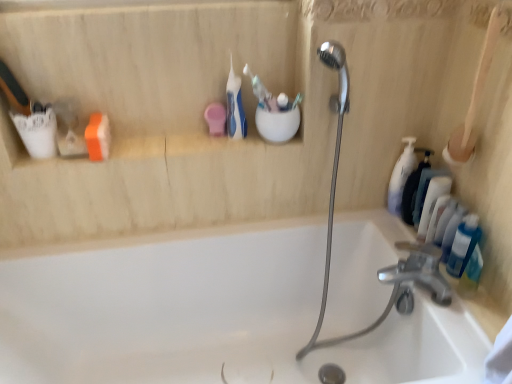
Question: Considering the positions of point (138, 332) and point (474, 276), is point (138, 332) closer or farther from the camera than point (474, 276)?

Choices:
 (A) farther
 (B) closer

Answer: (A)

Question: Visually, is white glossy bathtub at center positioned to the left or to the right of blue translucent bottle at right, the fourth toiletry when ordered from left to right?

Choices:
 (A) right
 (B) left

Answer: (B)

Question: Which of these objects is positioned closest to the translucent plastic bottles at right, arranged as the first toiletry when viewed from the right?

Choices:
 (A) blue plastic toothbrush at center, the 3th toothbrush in the right-to-left sequence
 (B) wooden handle brush at right
 (C) white glossy soap dispenser at right, acting as the second toiletry starting from the left
 (D) white glossy bathtub at center
 (E) white plastic toothbrushes at right, which is the third toiletry in left-to-right order

Answer: (E)

Question: Which object is positioned closest to the blue plastic toothbrush at upper center, the second toothbrush in the right-to-left sequence?

Choices:
 (A) white glossy bathtub at center
 (B) wooden handle brush at right
 (C) blue translucent bottle at right, the fourth toiletry when ordered from left to right
 (D) white plastic toothbrushes at right, marked as the third toiletry in a right-to-left arrangement
 (E) blue plastic toothbrush at center, the 3th toothbrush in the right-to-left sequence

Answer: (E)